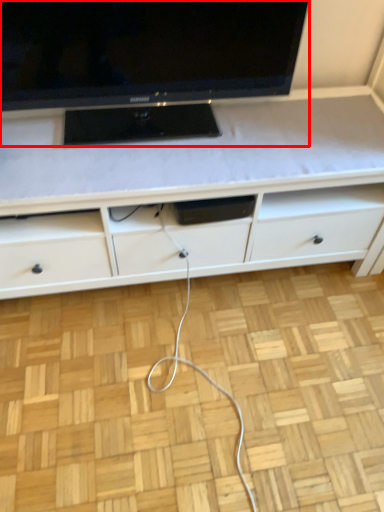
Question: From the image's perspective, what is the correct spatial positioning of television (annotated by the red box) in reference to cabinetry?

Choices:
 (A) above
 (B) below

Answer: (A)